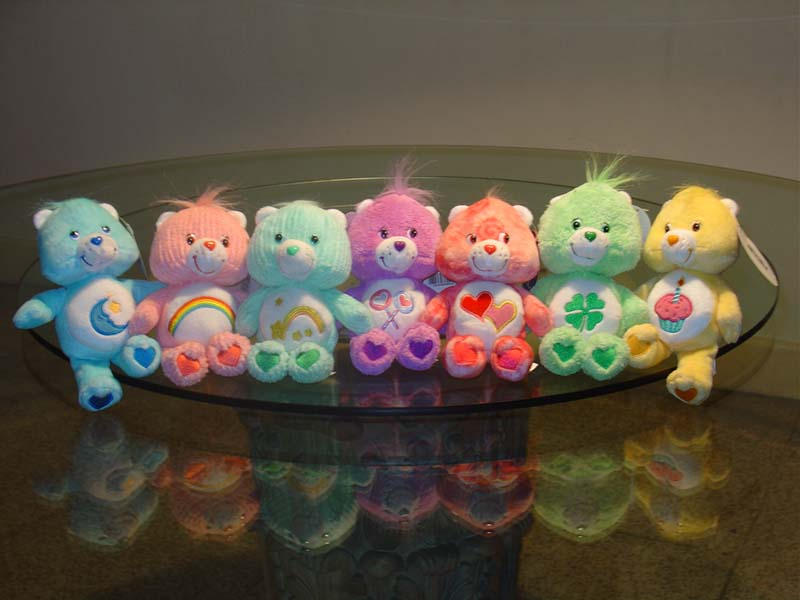
Find the location of a particular element. green clover decoration is located at coordinates (x=582, y=306).